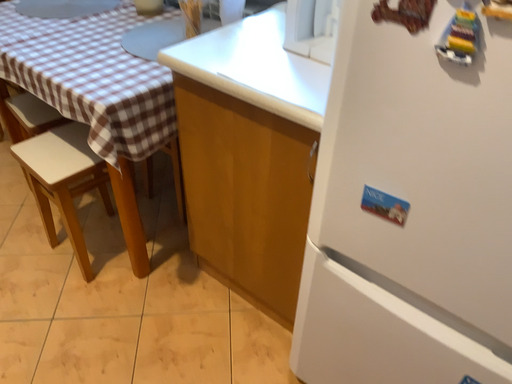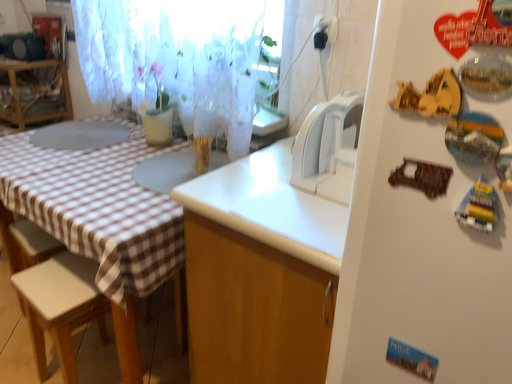
Question: How did the camera likely rotate when shooting the video?

Choices:
 (A) rotated upward
 (B) rotated downward

Answer: (A)